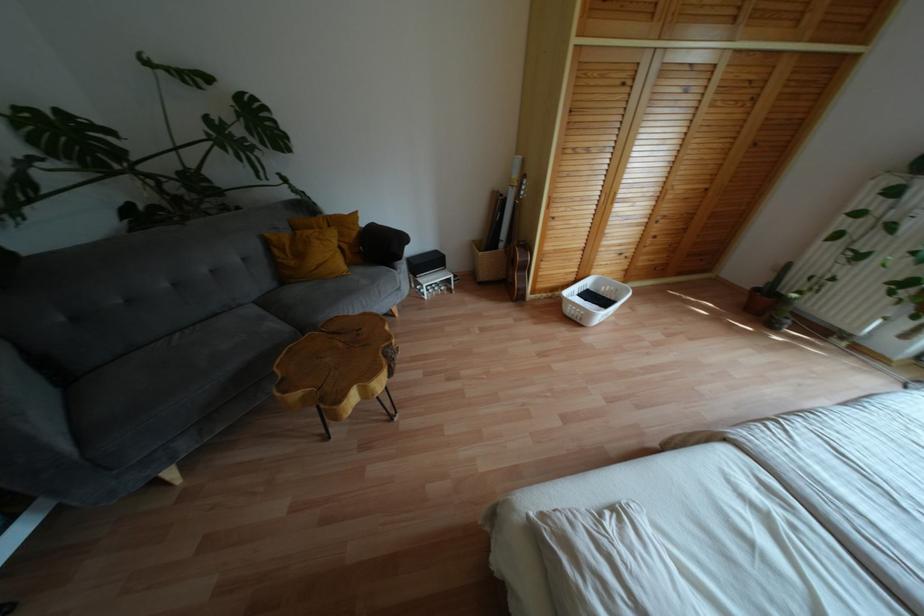
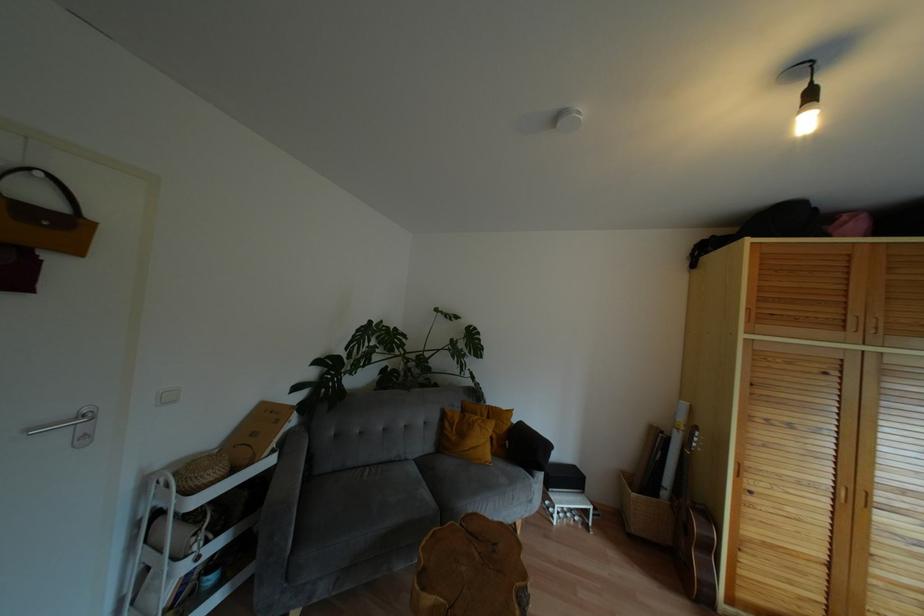
Find the pixel in the second image that matches the point at 614,193 in the first image.

(867, 493)